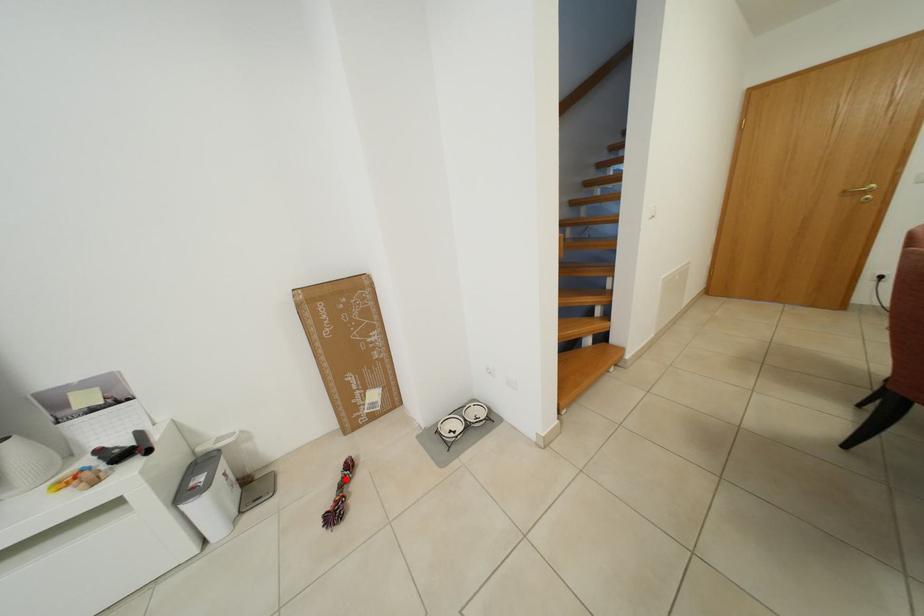
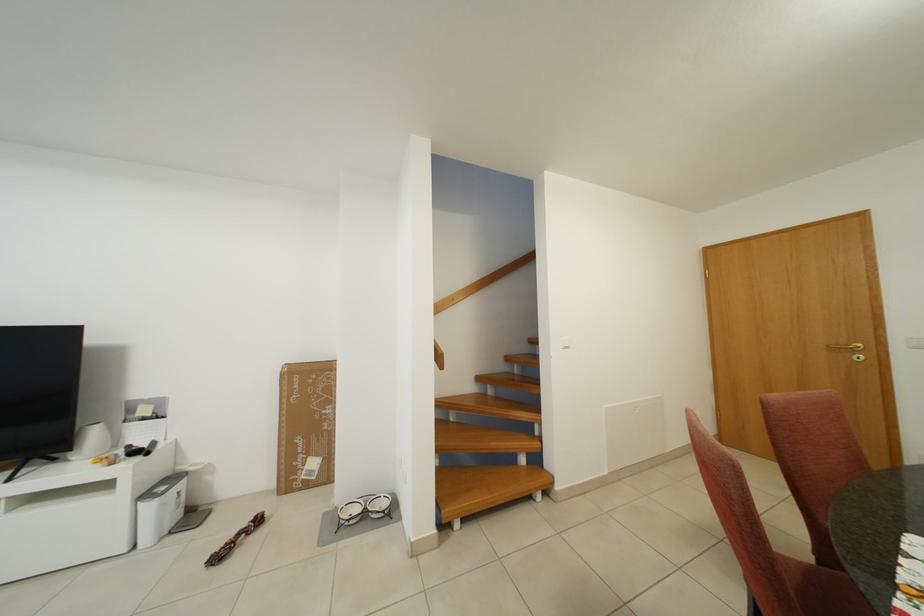
Where in the second image is the point corresponding to the highlighted location from the first image?

(252, 528)